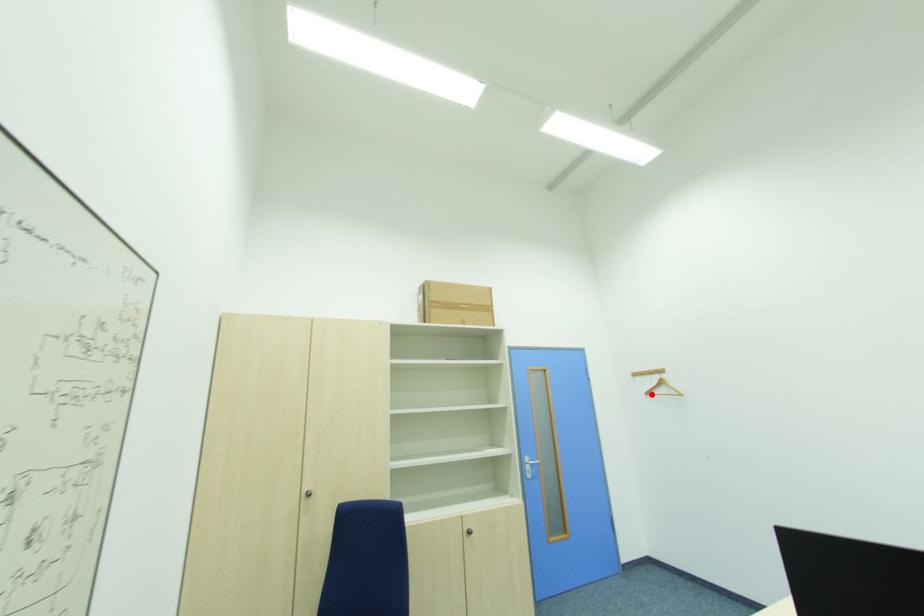
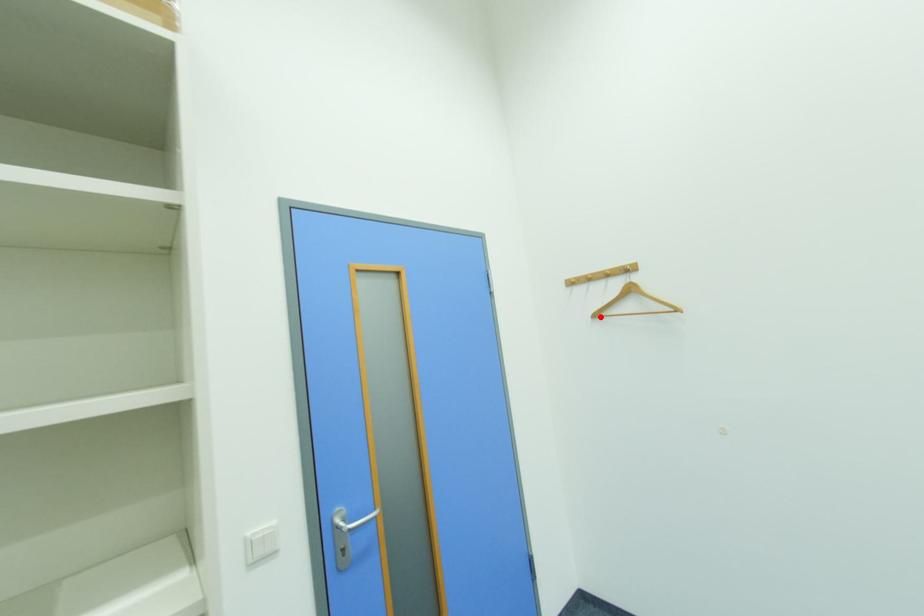
I am providing you with two images of the same scene from different viewpoints. A red point is marked on the first image and another point is marked on the second image. Are the points marked in image1 and image2 representing the same 3D position?

Yes